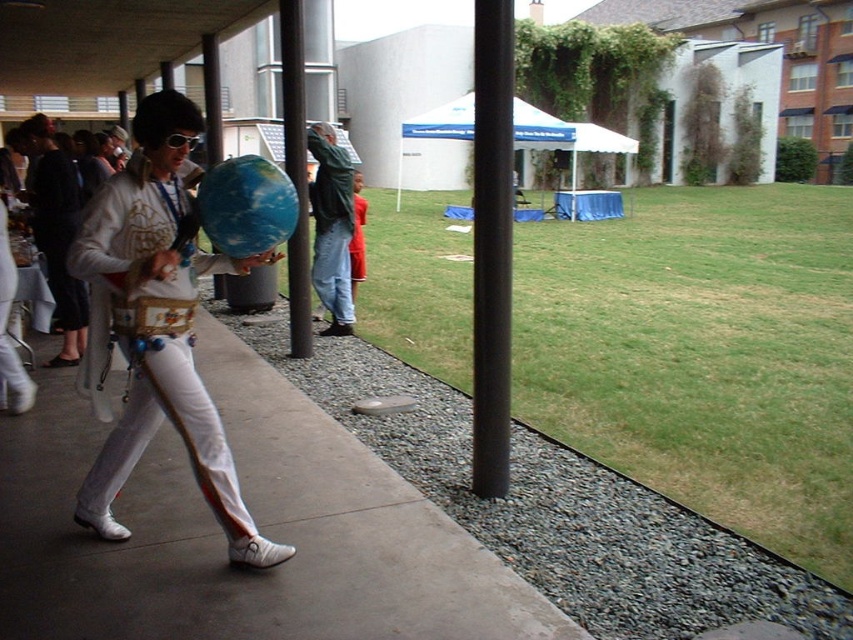
You are a photographer trying to capture a photo of the person in the Elvis Presley costume holding the globe. You notice jeans at center and black metal pole at center in your frame. Which object is narrower in your view?

The jeans at center is thinner than the black metal pole at center, so the jeans at center is narrower.

You are a photographer positioned at the end of the pathway. You want to take a photo of the shiny gold belt at center without including the concrete at center in the background. Is this possible given their positions?

The concrete at center is in front of the shiny gold belt at center, so it would block the view of the shiny gold belt at center. Therefore, it is not possible to take a photo of the shiny gold belt at center without including the concrete at center in the background.

You are standing at the center of the pathway in the courtyard. You see a point marked at coordinates [331,227]. What object is located at that point?

The point at coordinates [331,227] corresponds to jeans at center.